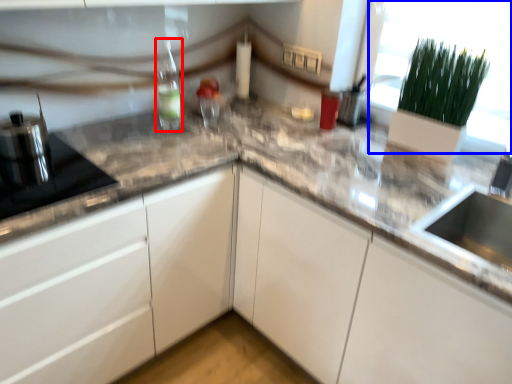
Question: Among these objects, which one is nearest to the camera, bottle (highlighted by a red box) or glass door (highlighted by a blue box)?

Choices:
 (A) bottle
 (B) glass door

Answer: (B)